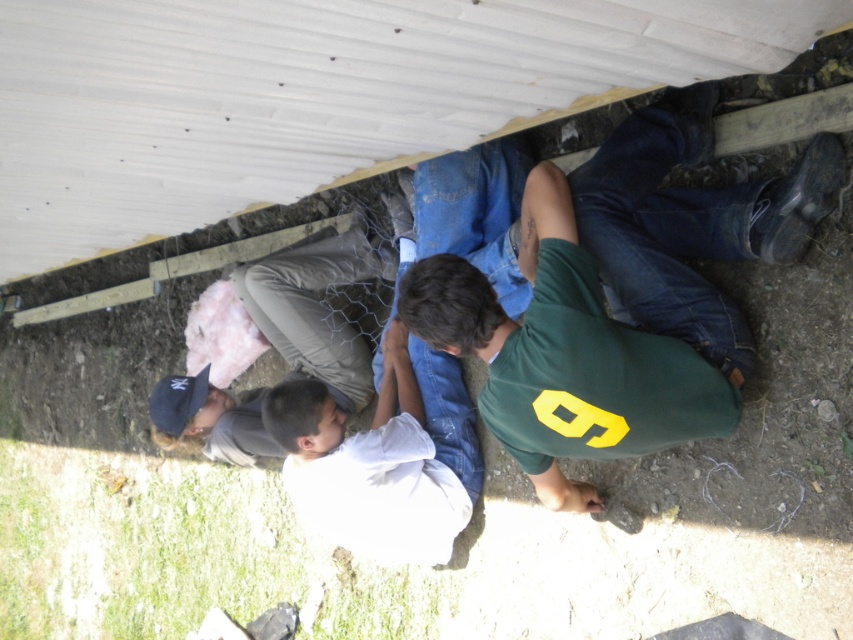
You are standing in the construction area and see the green jersey at center and the white cotton shirt at center. Which one is more to the right?

The green jersey at center is positioned on the right side of white cotton shirt at center, so it is more to the right.

You are a safety inspector observing the construction site. You notice two workers at the center of the scene wearing a green jersey at center and a white cotton shirt at center. According to safety protocols, workers must wear protective gear over their primary clothing. Which worker is violating the safety protocol?

The white cotton shirt at center is violating the safety protocol because the green jersey at center is in front of it, indicating that the white cotton shirt is underneath and not properly covered by the protective gear.